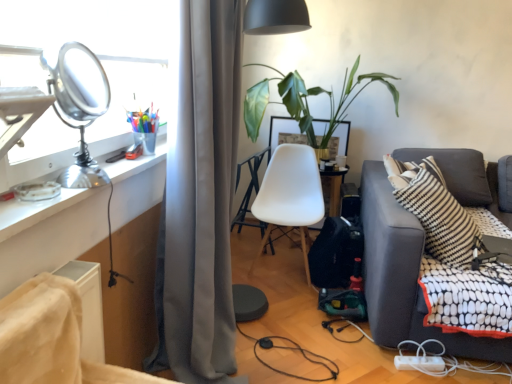
Where is `free space below white plastic chair at center, which is the 1th chair in right-to-left order (from a real-world perspective)`? The image size is (512, 384). free space below white plastic chair at center, which is the 1th chair in right-to-left order (from a real-world perspective) is located at coordinates (282, 271).